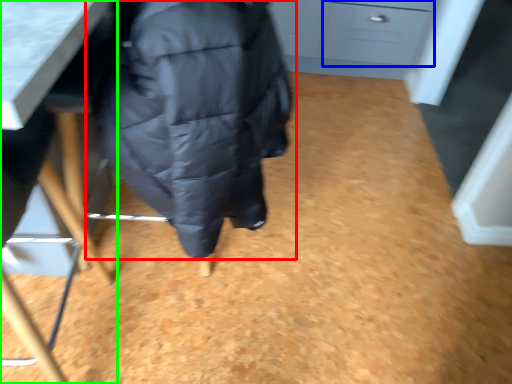
Question: Which object is the closest to the jacket (highlighted by a red box)? Choose among these: drawer (highlighted by a blue box) or furniture (highlighted by a green box).

Choices:
 (A) drawer
 (B) furniture

Answer: (B)